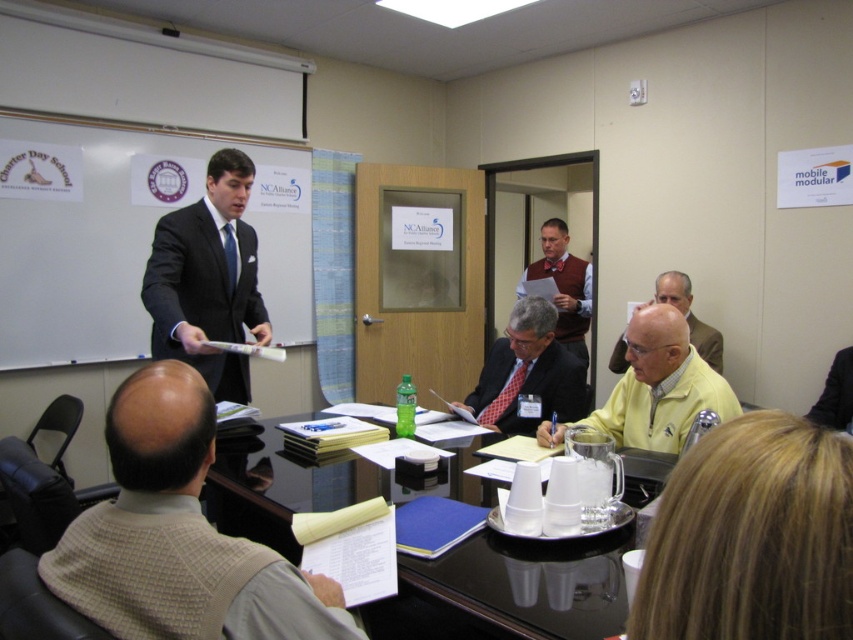
Who is taller, black glossy table at center or dark suit at center?

dark suit at center

Does black glossy table at center have a greater width compared to dark suit at center?

Correct, the width of black glossy table at center exceeds that of dark suit at center.

Does point (397, 598) lie behind point (215, 188)?

That is False.

Locate an element on the screen. The image size is (853, 640). black glossy table at center is located at coordinates (511, 589).

Does point (358, 483) come closer to viewer compared to point (570, 308)?

Yes, it is in front of point (570, 308).

You are a GUI agent. You are given a task and a screenshot of the screen. Output one action in this format:
    pyautogui.click(x=<x>, y=<y>)
    Task: Click on the black glossy table at center
    The width and height of the screenshot is (853, 640).
    Given the screenshot: What is the action you would take?
    pyautogui.click(x=511, y=589)

Does point (22, 145) come closer to viewer compared to point (526, 280)?

Yes, it is in front of point (526, 280).

At what (x,y) coordinates should I click in order to perform the action: click on whiteboard at left. Please return your answer as a coordinate pair (x, y). Image resolution: width=853 pixels, height=640 pixels. Looking at the image, I should click on (125, 234).